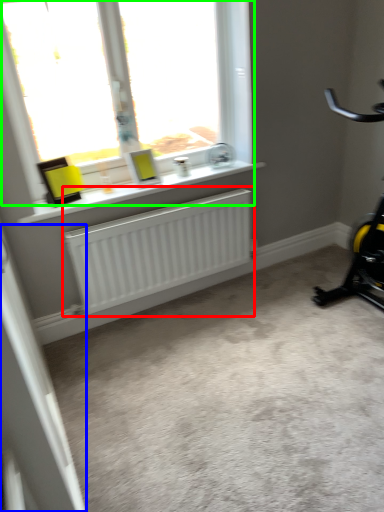
Question: Based on their relative distances, which object is nearer to radiator (highlighted by a red box)? Choose from screen door (highlighted by a blue box) and window (highlighted by a green box).

Choices:
 (A) screen door
 (B) window

Answer: (B)